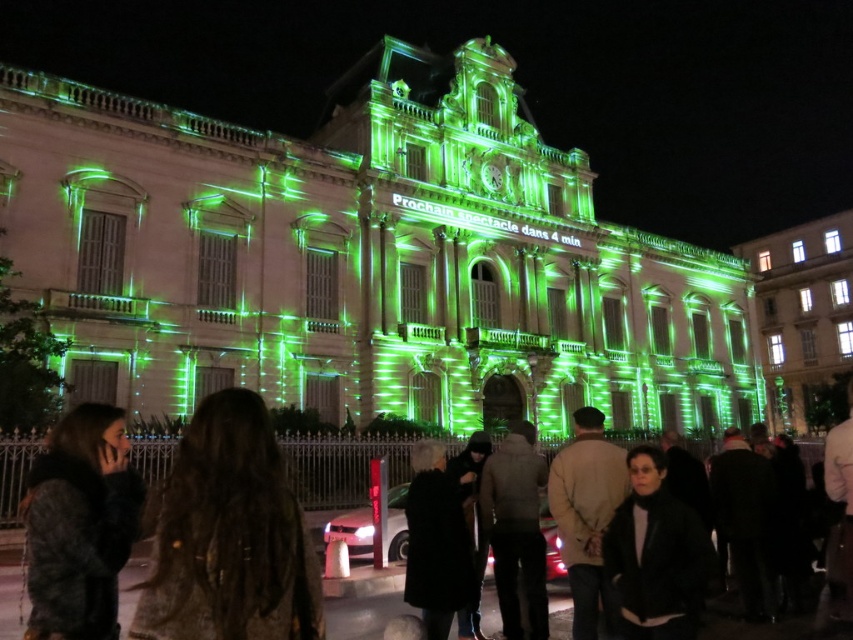
You are a photographer standing at the front of the scene. You need to capture a photo that includes both the dark brown leather jacket at lower left and the dark brown fur coat at lower left. Which object should you focus on first to ensure both are in frame?

The dark brown leather jacket at lower left has a larger size compared to dark brown fur coat at lower left, so you should focus on the dark brown leather jacket at lower left first to ensure both are in frame.